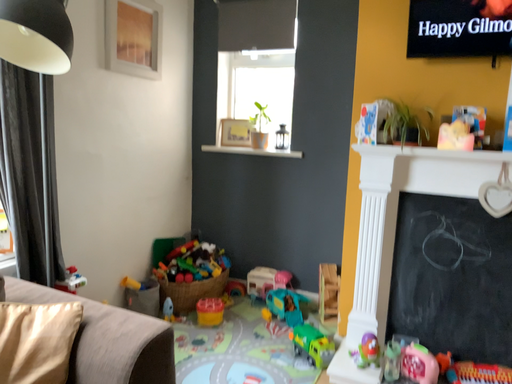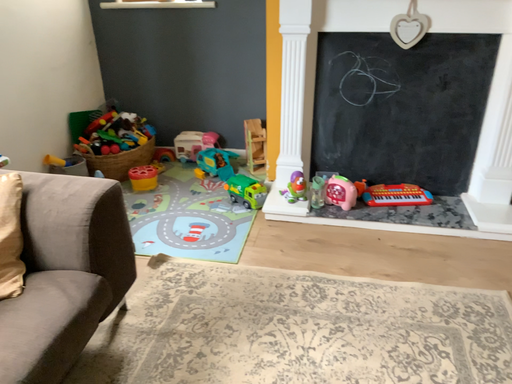
Question: How did the camera likely rotate when shooting the video?

Choices:
 (A) rotated upward
 (B) rotated downward

Answer: (B)